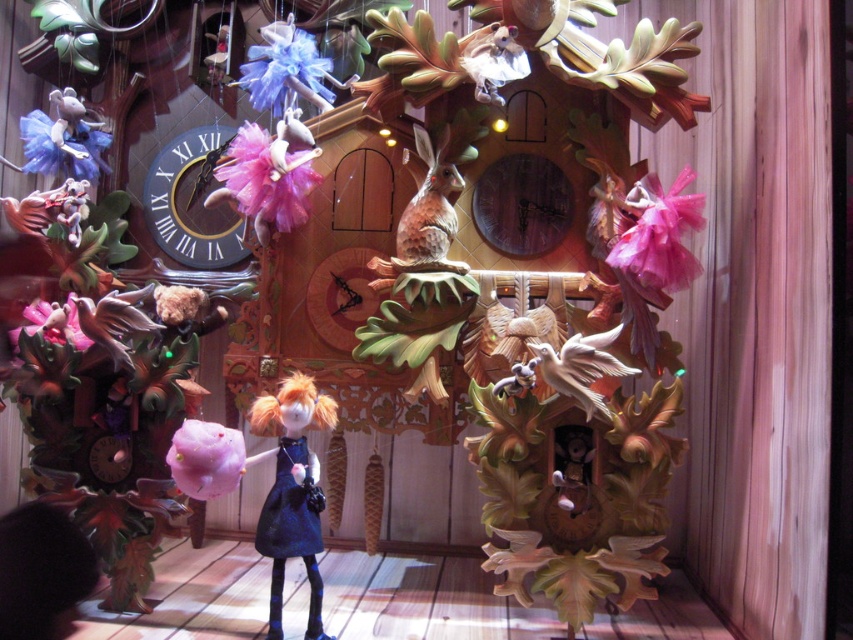
Question: Is brown speckled rabbit at center positioned before wooden duckling at lower center?

Choices:
 (A) no
 (B) yes

Answer: (A)

Question: Can you confirm if pink tulle flower at upper right is wider than wooden carved bird at center?

Choices:
 (A) no
 (B) yes

Answer: (A)

Question: Which object appears closest to the camera in this image?

Choices:
 (A) matte purple tulle at upper center
 (B) matte black clock at left
 (C) pink fluffy flower at center
 (D) brown speckled rabbit at center

Answer: (C)

Question: Is matte purple tulle at upper center positioned before wooden carved bird at center?

Choices:
 (A) yes
 (B) no

Answer: (B)

Question: Which of the following is the closest to the observer?

Choices:
 (A) wooden duckling at lower center
 (B) matte black clock at left

Answer: (A)

Question: Which point is closer to the camera?

Choices:
 (A) (619, 332)
 (B) (250, 97)
 (C) (196, 221)
 (D) (582, 506)

Answer: (A)